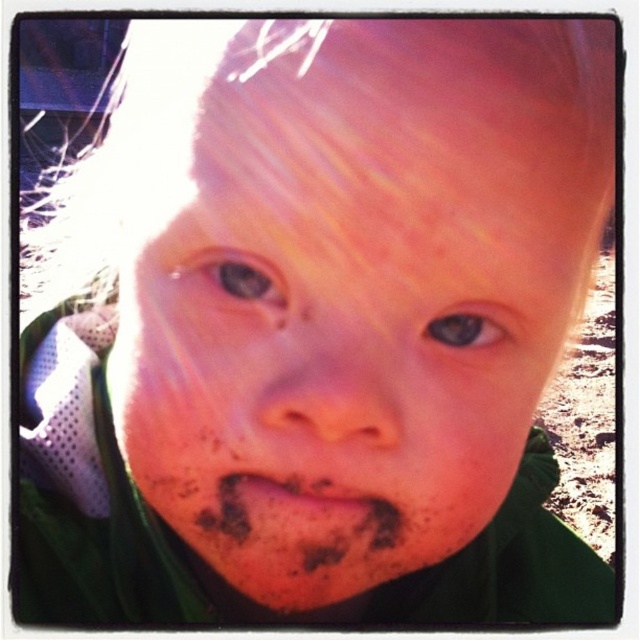
You are a photographer trying to capture a close up shot of the child. The dusty brown lips at center are currently 9.80 inches away from the camera. If you want to ensure the lips are in focus, should you move closer or farther away?

The dusty brown lips at center are already 9.80 inches away from the camera. To ensure they are in focus, you should not move closer or farther away since the current distance is appropriate for a close up shot.

Based on the scene description, which object is wider between the dusty brown lips at center and the brown matte eye at center?

The dusty brown lips at center are wider than the brown matte eye at center according to the description.

The child in the image has an eye located at coordinates 0.430, 0.369. If the image is displayed on a screen with a resolution of 1920x1080 pixels, what are the pixel coordinates of the brown matte eye at upper left?

The pixel coordinates can be calculated by multiplying the normalized coordinates by the screen resolution. For the x coordinate, 0.430 multiplied by 1920 equals approximately 825.6 pixels. For the y coordinate, 0.369 multiplied by 1080 equals approximately 398.52 pixels. Therefore, the brown matte eye at upper left is located at approximately pixel coordinates (639,639).